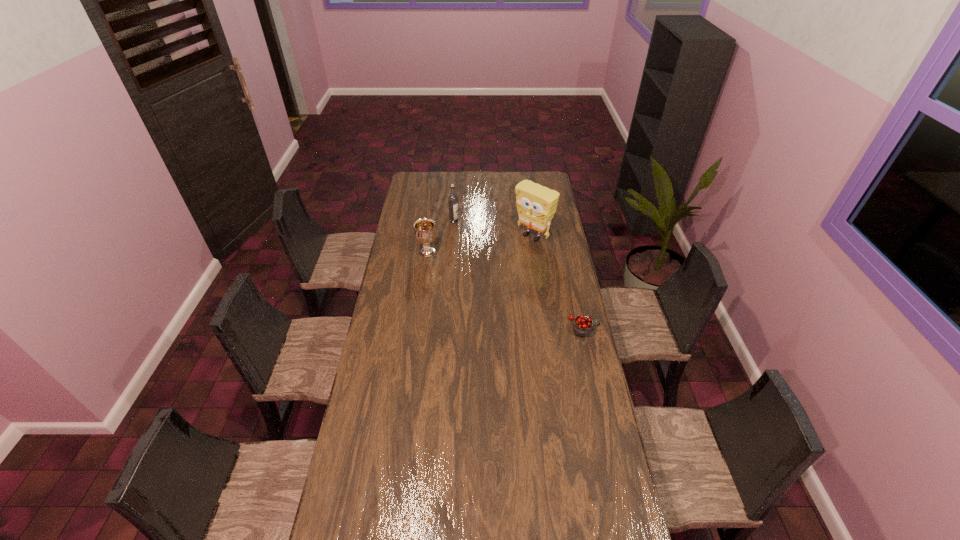
Locate an element on the screen. blank space at the far left corner of the desktop is located at coordinates point(420,173).

Where is `unoccupied position between the sponge and the chalice`? unoccupied position between the sponge and the chalice is located at coordinates (480, 244).

I want to click on free space between the sponge and the shortest object, so click(x=558, y=282).

You are a GUI agent. You are given a task and a screenshot of the screen. Output one action in this format:
    pyautogui.click(x=<x>, y=<y>)
    Task: Click on the vacant area between the sponge and the leftmost object
    
    Given the screenshot: What is the action you would take?
    pyautogui.click(x=480, y=244)

Find the location of a particular element. free spot between the second tallest object and the chalice is located at coordinates (441, 237).

The image size is (960, 540). I want to click on vacant region between the third object from right to left and the third tallest object, so click(x=441, y=237).

You are a GUI agent. You are given a task and a screenshot of the screen. Output one action in this format:
    pyautogui.click(x=<x>, y=<y>)
    Task: Click on the free spot between the third object from right to left and the pot filled with cherries
    This screenshot has height=540, width=960.
    Given the screenshot: What is the action you would take?
    pyautogui.click(x=518, y=274)

Identify the location of vacant area between the pot filled with cherries and the sponge. pyautogui.click(x=558, y=282).

In order to click on vacant space in between the leftmost object and the sponge in this screenshot , I will do `click(480, 244)`.

The width and height of the screenshot is (960, 540). What are the coordinates of `unoccupied area between the shortest object and the leftmost object` in the screenshot? It's located at (505, 290).